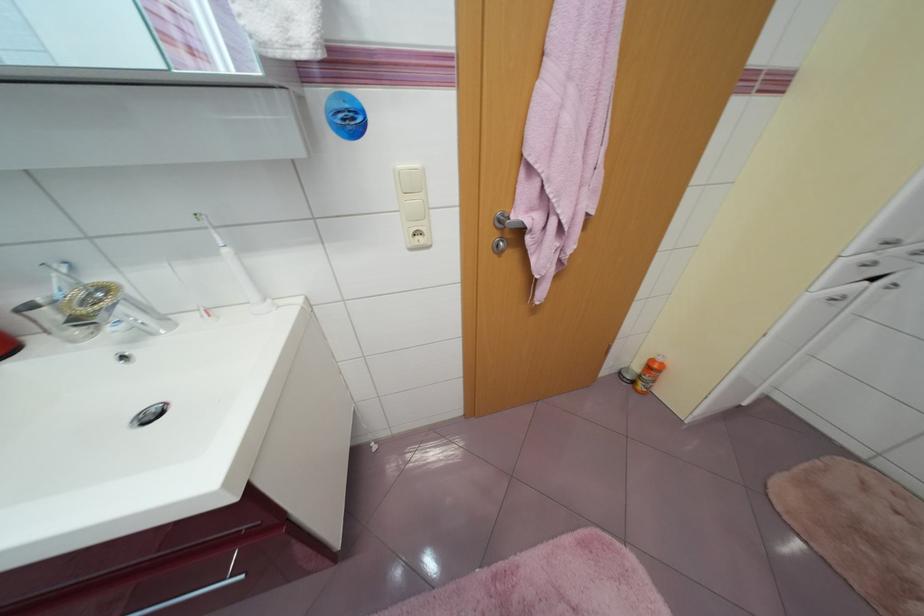
Where is `white power outlet`? This screenshot has height=616, width=924. white power outlet is located at coordinates (417, 236).